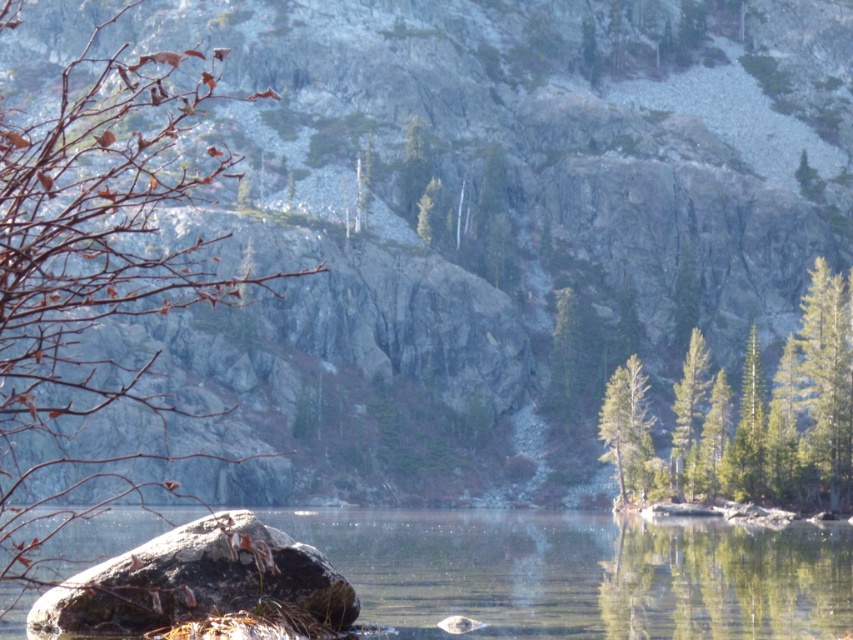
You are an environmental scientist examining the landscape. You need to determine the relative positions of the green textured trees at center and the green matte tree at right. Which tree is positioned to the left of the other?

The green textured trees at center are positioned to the left of the green matte tree at right.